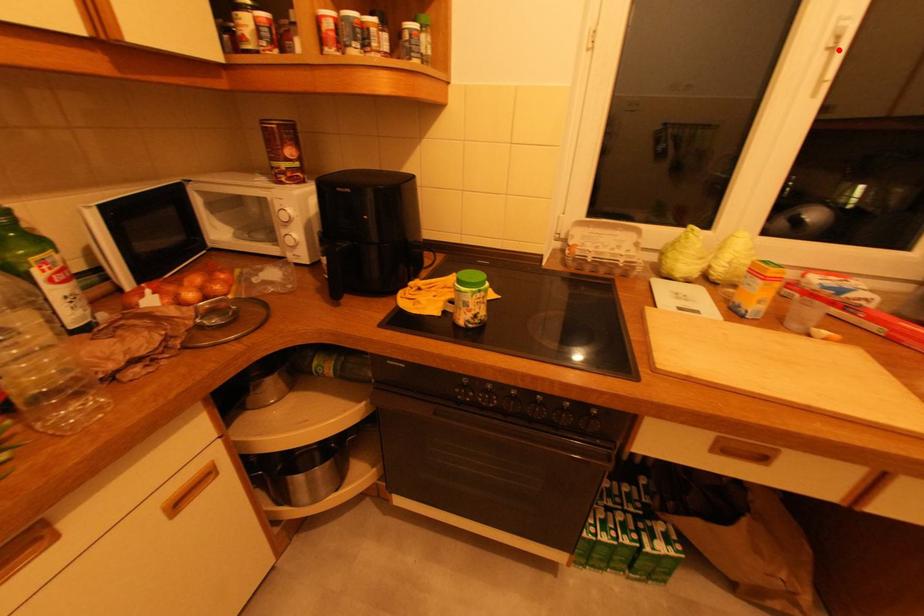
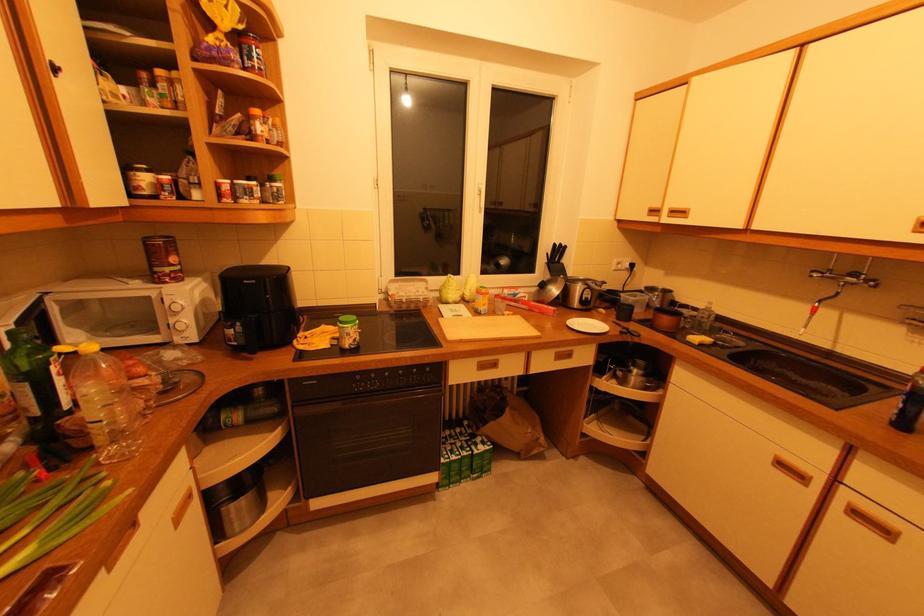
Where in the second image is the point corresponding to the highlighted location from the first image?

(482, 196)